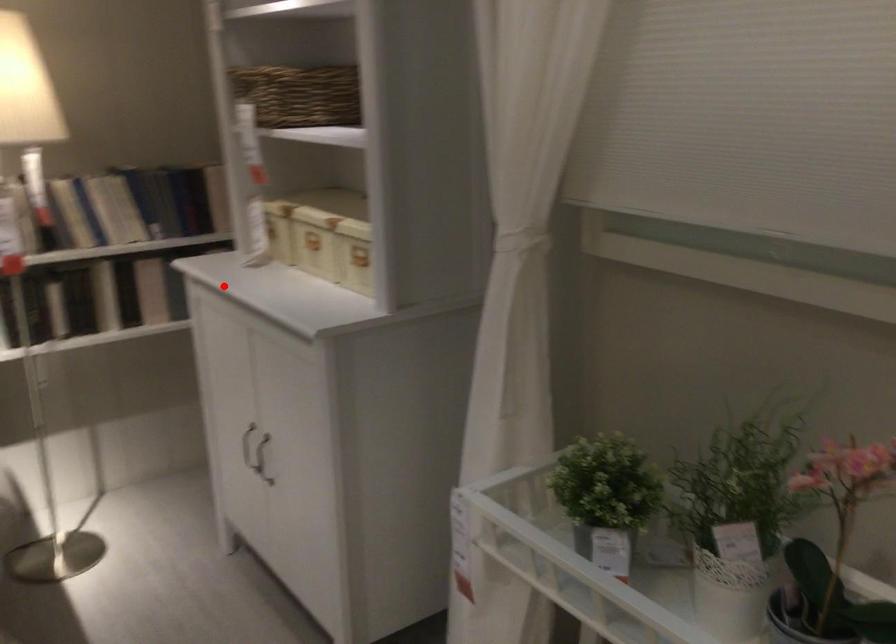
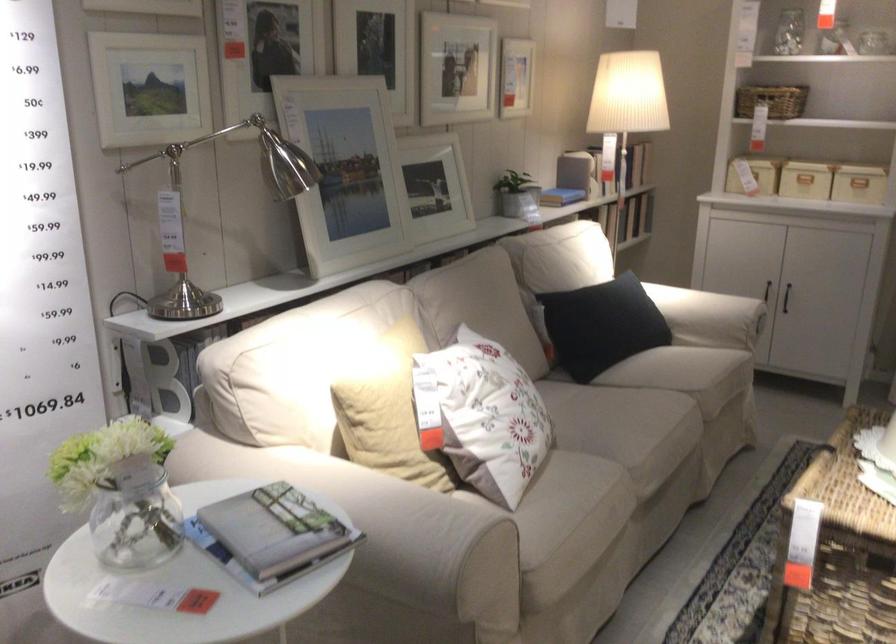
Question: I am providing you with two images of the same scene from different viewpoints. A red point is shown in image1. For the corresponding object point in image2, is it positioned nearer or farther from the camera?

Choices:
 (A) Nearer
 (B) Farther

Answer: (B)